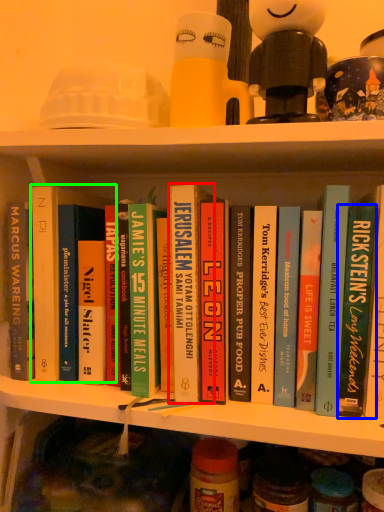
Question: Which object is the farthest from book (highlighted by a red box)? Choose among these: book (highlighted by a blue box) or book (highlighted by a green box).

Choices:
 (A) book
 (B) book

Answer: (A)